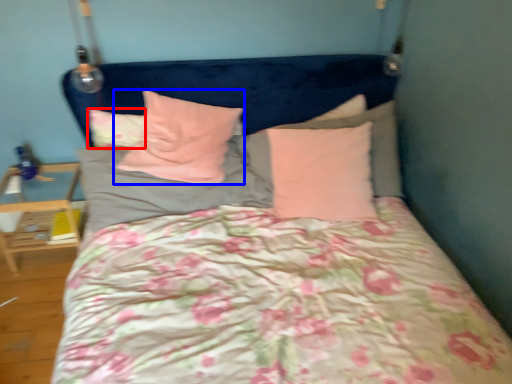
Question: Among these objects, which one is nearest to the camera, pillow (highlighted by a red box) or pillow (highlighted by a blue box)?

Choices:
 (A) pillow
 (B) pillow

Answer: (B)